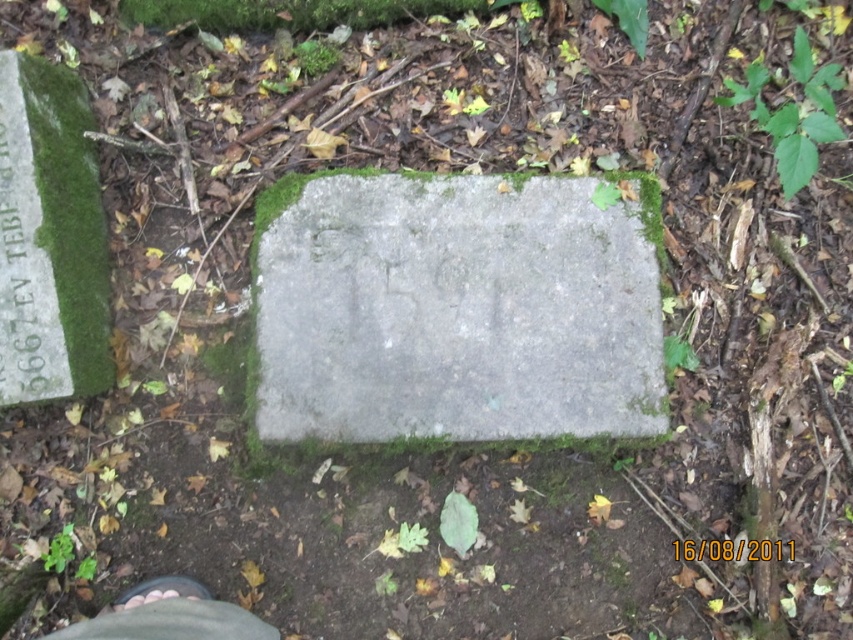
Is gray concrete at center smaller than brown leather shoe at lower left?

Incorrect, gray concrete at center is not smaller in size than brown leather shoe at lower left.

Does gray concrete at center appear on the right side of brown leather shoe at lower left?

Yes, gray concrete at center is to the right of brown leather shoe at lower left.

This screenshot has height=640, width=853. What are the coordinates of `gray concrete at center` in the screenshot? It's located at (456, 308).